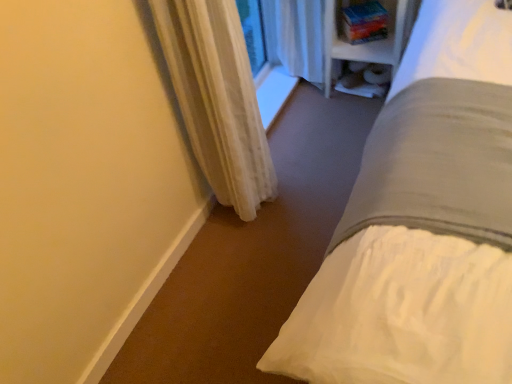
The width and height of the screenshot is (512, 384). Identify the location of white fabric shelf at upper right. (365, 79).

What do you see at coordinates (217, 99) in the screenshot? I see `white sheer curtain at lower left` at bounding box center [217, 99].

The height and width of the screenshot is (384, 512). Find the location of `white fabric shelf at upper right`. white fabric shelf at upper right is located at coordinates (365, 79).

Considering the relative positions of white fabric shelf at upper right and white sheer curtain at lower left in the image provided, is white fabric shelf at upper right behind white sheer curtain at lower left?

Yes, white fabric shelf at upper right is behind white sheer curtain at lower left.

Does white fabric shelf at upper right have a lesser height compared to white sheer curtain at lower left?

Yes, white fabric shelf at upper right is shorter than white sheer curtain at lower left.

From the image's perspective, is white fabric shelf at upper right positioned above or below white sheer curtain at lower left?

white fabric shelf at upper right is above white sheer curtain at lower left.

Looking at this image, which is less distant, (x=366, y=59) or (x=388, y=68)?

Point (x=366, y=59) is positioned closer to the camera compared to point (x=388, y=68).

Can you tell me how much white plastic bookshelf at upper right and white fabric shelf at upper right differ in facing direction?

1.8 degrees separate the facing orientations of white plastic bookshelf at upper right and white fabric shelf at upper right.

From a real-world perspective, relative to white fabric shelf at upper right, is white plastic bookshelf at upper right vertically above or below?

white plastic bookshelf at upper right is situated higher than white fabric shelf at upper right in the real world.

Is white plastic bookshelf at upper right at the left side of white fabric shelf at upper right?

Yes.

Could you tell me if white plastic bookshelf at upper right is facing white sheer curtain at lower left?

Yes, white plastic bookshelf at upper right is aimed at white sheer curtain at lower left.

Is point (344, 2) behind point (213, 63)?

Yes, point (344, 2) is farther from viewer.

From the image's perspective, relative to white sheer curtain at lower left, is white plastic bookshelf at upper right above or below?

From the image's perspective, white plastic bookshelf at upper right appears above white sheer curtain at lower left.

Which is more to the right, white sheer curtain at lower left or white plastic bookshelf at upper right?

Positioned to the right is white plastic bookshelf at upper right.

From a real-world perspective, is white sheer curtain at lower left positioned above or below white plastic bookshelf at upper right?

white sheer curtain at lower left is situated higher than white plastic bookshelf at upper right in the real world.

Can you confirm if white sheer curtain at lower left is shorter than white plastic bookshelf at upper right?

No, white sheer curtain at lower left is not shorter than white plastic bookshelf at upper right.

Looking at this image, in terms of height, does white sheer curtain at lower left look taller or shorter compared to white fabric shelf at upper right?

In the image, white sheer curtain at lower left appears to be taller than white fabric shelf at upper right.

Is white sheer curtain at lower left oriented away from white fabric shelf at upper right?

white sheer curtain at lower left is not turned away from white fabric shelf at upper right.

Does point (227, 172) come behind point (389, 74)?

No, it is in front of (389, 74).

Considering the relative sizes of white sheer curtain at lower left and white fabric shelf at upper right in the image provided, is white sheer curtain at lower left smaller than white fabric shelf at upper right?

Incorrect, white sheer curtain at lower left is not smaller in size than white fabric shelf at upper right.

Considering the sizes of objects white fabric shelf at upper right and white plastic bookshelf at upper right in the image provided, who is thinner, white fabric shelf at upper right or white plastic bookshelf at upper right?

Thinner between the two is white fabric shelf at upper right.

In the scene shown: Considering the relative positions of white fabric shelf at upper right and white plastic bookshelf at upper right in the image provided, is white fabric shelf at upper right behind white plastic bookshelf at upper right?

That is True.

You are a GUI agent. You are given a task and a screenshot of the screen. Output one action in this format:
    pyautogui.click(x=<x>, y=<y>)
    Task: Click on the bookshelf above the white fabric shelf at upper right (from a real-world perspective)
    This screenshot has height=384, width=512.
    Given the screenshot: What is the action you would take?
    pyautogui.click(x=368, y=42)

Could you tell me if white fabric shelf at upper right is turned towards white plastic bookshelf at upper right?

Yes, white fabric shelf at upper right is aimed at white plastic bookshelf at upper right.

The width and height of the screenshot is (512, 384). I want to click on shelf located above the white sheer curtain at lower left (from the image's perspective), so click(365, 79).

Find the location of a particular element. The image size is (512, 384). shelf below the white plastic bookshelf at upper right (from the image's perspective) is located at coordinates [x=365, y=79].

Considering their positions, is white fabric shelf at upper right positioned further to white sheer curtain at lower left than white plastic bookshelf at upper right?

The object further to white sheer curtain at lower left is white fabric shelf at upper right.

Which object lies further to the anchor point white plastic bookshelf at upper right, white sheer curtain at lower left or white fabric shelf at upper right?

Based on the image, white sheer curtain at lower left appears to be further to white plastic bookshelf at upper right.

From the image, which object appears to be nearer to white plastic bookshelf at upper right, white fabric shelf at upper right or white sheer curtain at lower left?

white fabric shelf at upper right is positioned closer to the anchor white plastic bookshelf at upper right.

Based on their spatial positions, is white plastic bookshelf at upper right or white fabric shelf at upper right closer to white sheer curtain at lower left?

Among the two, white plastic bookshelf at upper right is located nearer to white sheer curtain at lower left.

Which object lies nearer to the anchor point white fabric shelf at upper right, white plastic bookshelf at upper right or white sheer curtain at lower left?

The object closer to white fabric shelf at upper right is white plastic bookshelf at upper right.

From the image, which object appears to be farther from white fabric shelf at upper right, white sheer curtain at lower left or white plastic bookshelf at upper right?

white sheer curtain at lower left is positioned further to the anchor white fabric shelf at upper right.

Where is `bookshelf positioned between white sheer curtain at lower left and white fabric shelf at upper right from near to far`? This screenshot has height=384, width=512. bookshelf positioned between white sheer curtain at lower left and white fabric shelf at upper right from near to far is located at coordinates (368, 42).